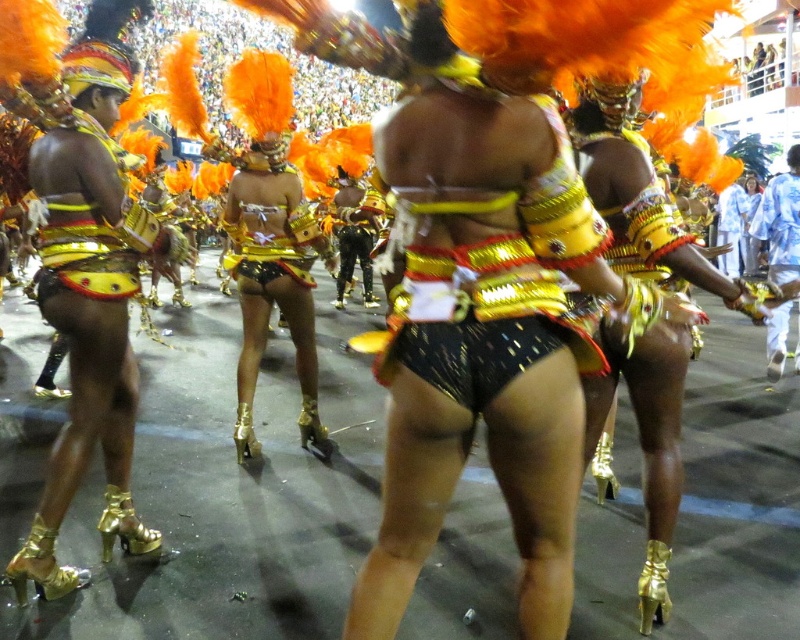
Between point (760, 202) and point (341, 236), which one is positioned in front?

Point (760, 202)

Which of these two, blue fabric pants at right or shiny black pants at center, stands taller?

With more height is blue fabric pants at right.

Image resolution: width=800 pixels, height=640 pixels. What do you see at coordinates (780, 221) in the screenshot?
I see `blue fabric pants at right` at bounding box center [780, 221].

Locate an element on the screen. Image resolution: width=800 pixels, height=640 pixels. blue fabric pants at right is located at coordinates (780, 221).

Can you confirm if shiny gold shorts at center is shorter than shiny black pants at center?

No.

Based on the photo, is the position of shiny gold shorts at center more distant than that of shiny black pants at center?

No, shiny gold shorts at center is closer to the viewer.

The image size is (800, 640). What do you see at coordinates (90, 307) in the screenshot? I see `shiny gold shorts at center` at bounding box center [90, 307].

Locate an element on the screen. Image resolution: width=800 pixels, height=640 pixels. shiny gold shorts at center is located at coordinates (90, 307).

Can you confirm if shiny gold shorts at center is smaller than blue fabric pants at right?

Yes, shiny gold shorts at center is smaller than blue fabric pants at right.

Does shiny gold shorts at center appear on the left side of blue fabric pants at right?

Indeed, shiny gold shorts at center is positioned on the left side of blue fabric pants at right.

Between point (90, 348) and point (780, 188), which one is positioned in front?

Point (90, 348) is in front.

Image resolution: width=800 pixels, height=640 pixels. I want to click on shiny gold shorts at center, so click(90, 307).